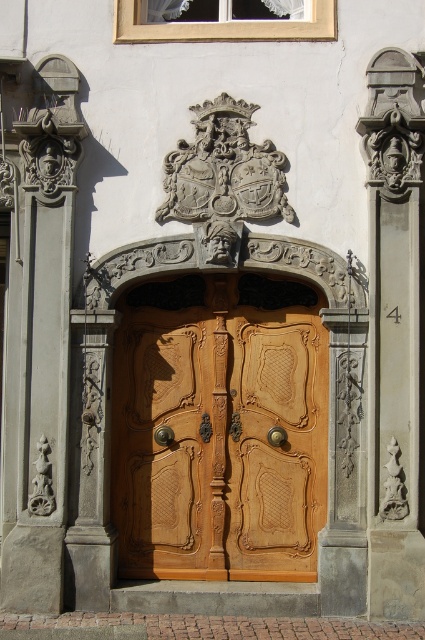
How far apart are wooden carved door at center and stone carving at right?

A distance of 1.36 meters exists between wooden carved door at center and stone carving at right.

Is wooden carved door at center shorter than stone carving at right?

Yes.

Where is `wooden carved door at center`? The width and height of the screenshot is (425, 640). wooden carved door at center is located at coordinates (220, 428).